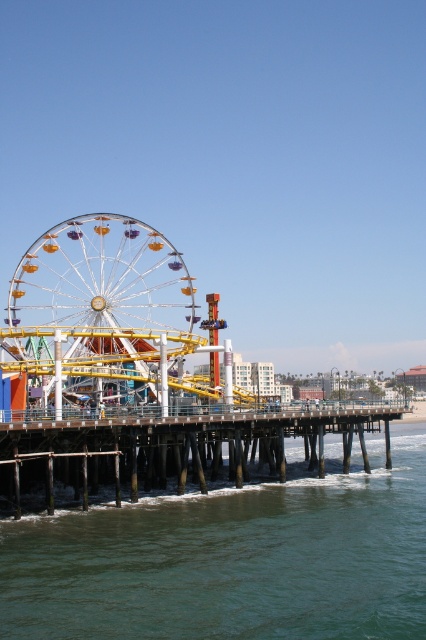
Question: Which of the following is the closest to the observer?

Choices:
 (A) (112, 616)
 (B) (124, 486)
 (C) (80, 292)

Answer: (A)

Question: Is greenish-blue water at lower center wider than metallic silver ferris wheel at center?

Choices:
 (A) yes
 (B) no

Answer: (A)

Question: Which point appears closest to the camera in this image?

Choices:
 (A) (112, 301)
 (B) (54, 452)
 (C) (241, 497)

Answer: (B)

Question: Is greenish-blue water at lower center thinner than brown wooden dock at lower center?

Choices:
 (A) yes
 (B) no

Answer: (B)

Question: Which is nearer to the brown wooden dock at lower center?

Choices:
 (A) metallic silver ferris wheel at center
 (B) greenish-blue water at lower center

Answer: (B)

Question: Is greenish-blue water at lower center to the right of metallic silver ferris wheel at center from the viewer's perspective?

Choices:
 (A) no
 (B) yes

Answer: (B)